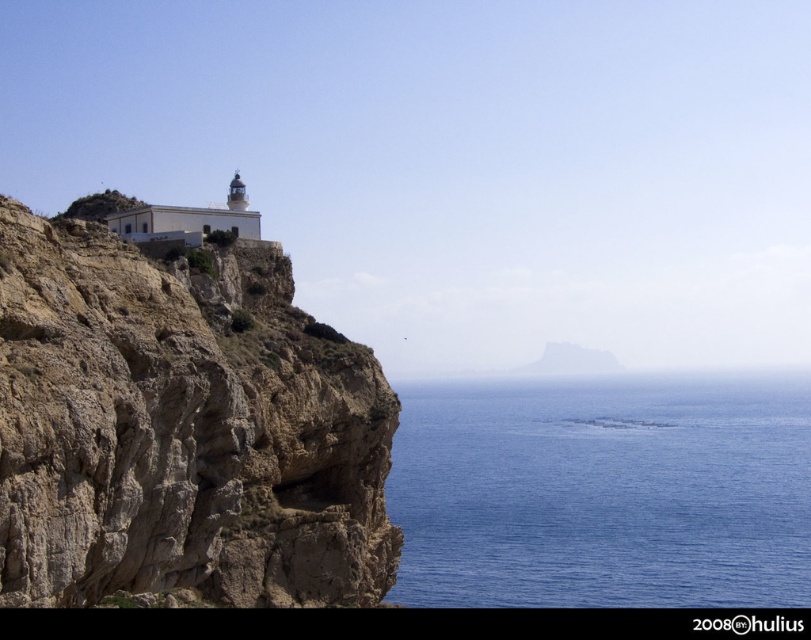
Measure the distance between brown rough rock at upper left and camera.

brown rough rock at upper left is 126.97 feet from camera.

What do you see at coordinates (181, 429) in the screenshot?
I see `brown rough rock at upper left` at bounding box center [181, 429].

This screenshot has width=811, height=640. Find the location of `brown rough rock at upper left`. brown rough rock at upper left is located at coordinates (181, 429).